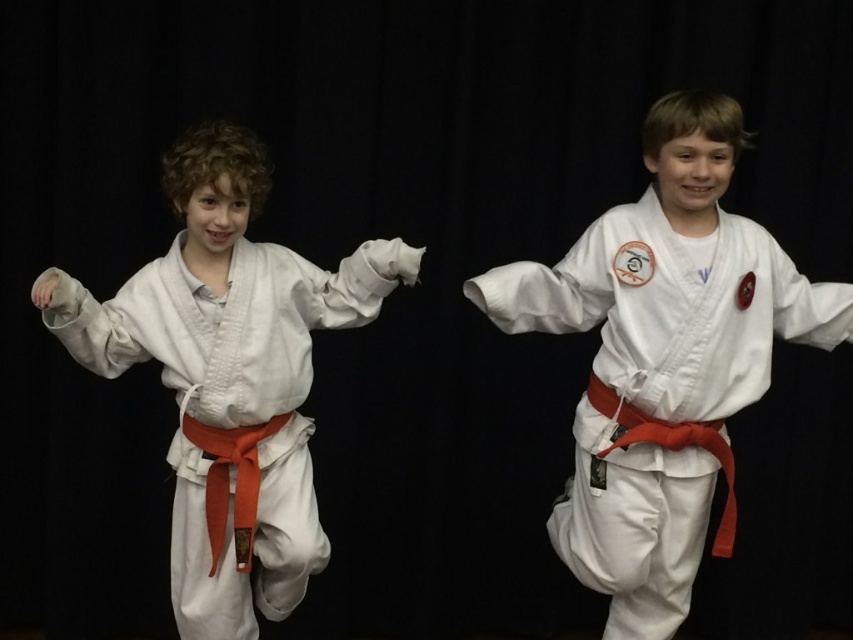
You are a photographer setting up for a karate demonstration. You need to ensure that the white matte karate uniform at center is in focus. Given that your camera has a depth of field that can sharply focus objects within 6 feet from the lens, will the uniform be in focus?

The white matte karate uniform at center is 6.65 feet away from camera, which is just beyond the 6 feet depth of field range. Therefore, the uniform will not be in focus.

You are a photographer setting up for a karate demonstration. You need to place two markers at the coordinates point (659, 371) and point (137, 342). According to the image, which marker is positioned closer to the front of the scene?

Point (137, 342) is positioned closer to the front of the scene because the Objects Description states that point (659, 371) is behind point (137, 342).

In the scene shown: You are a photographer setting up for a karate demonstration. The karate uniform must be centered at point 0.5 on the x and y axis. Based on the scene, is the white matte karate uniform at center positioned correctly?

The white matte karate uniform at center is at point (663,358), which is not exactly at 0.5 on both axes, so it is not perfectly centered.